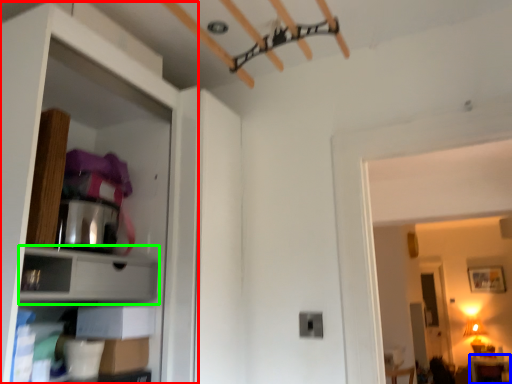
Question: Estimate the real-world distances between objects in this image. Which object is closer to dresser (highlighted by a red box), furniture (highlighted by a blue box) or cabinet (highlighted by a green box)?

Choices:
 (A) furniture
 (B) cabinet

Answer: (B)